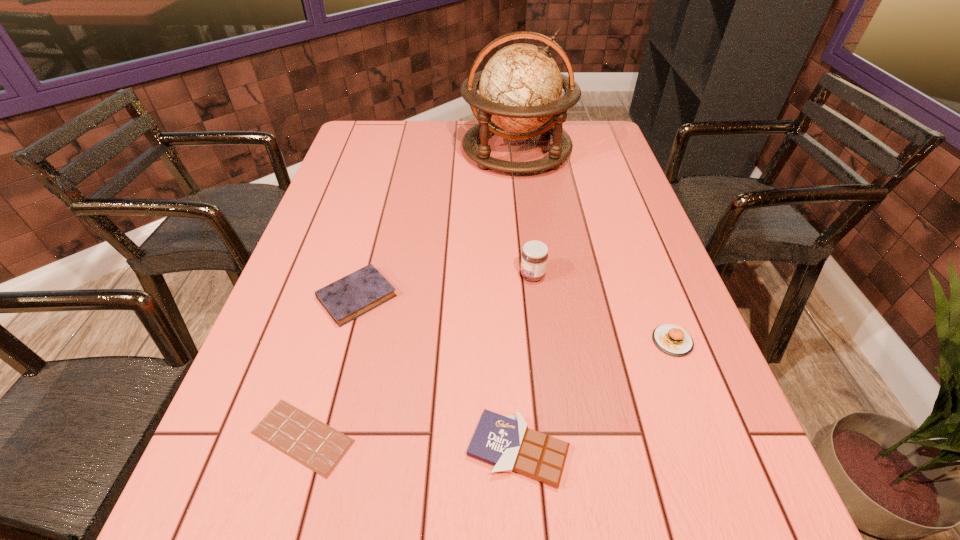
I want to click on unoccupied position between the diary and the taller chocolate bar, so click(438, 373).

The height and width of the screenshot is (540, 960). Find the location of `vacant point located between the second shortest object and the right chocolate bar`. vacant point located between the second shortest object and the right chocolate bar is located at coordinates (438, 373).

You are a GUI agent. You are given a task and a screenshot of the screen. Output one action in this format:
    pyautogui.click(x=<x>, y=<y>)
    Task: Click on the empty space between the shorter chocolate bar and the diary
    The image size is (960, 540).
    Given the screenshot: What is the action you would take?
    pyautogui.click(x=329, y=367)

The image size is (960, 540). I want to click on free space that is in between the left chocolate bar and the tallest object, so click(x=410, y=294).

What are the coordinates of `free space between the jam and the diary` in the screenshot? It's located at (444, 286).

You are a GUI agent. You are given a task and a screenshot of the screen. Output one action in this format:
    pyautogui.click(x=<x>, y=<y>)
    Task: Click on the free spot between the food and the jam
    This screenshot has height=540, width=960.
    Given the screenshot: What is the action you would take?
    pyautogui.click(x=603, y=308)

I want to click on free spot between the shortest object and the farthest object, so click(410, 294).

Locate an element on the screen. free space between the left chocolate bar and the jam is located at coordinates (418, 356).

This screenshot has height=540, width=960. Identify the location of object that stands as the third closest to the rightmost object. (348, 298).

Choose which object is the fourth nearest neighbor to the taller chocolate bar. Please provide its 2D coordinates. Your answer should be formatted as a tuple, i.e. [(x, y)], where the tuple contains the x and y coordinates of a point satisfying the conditions above.

[(534, 258)]